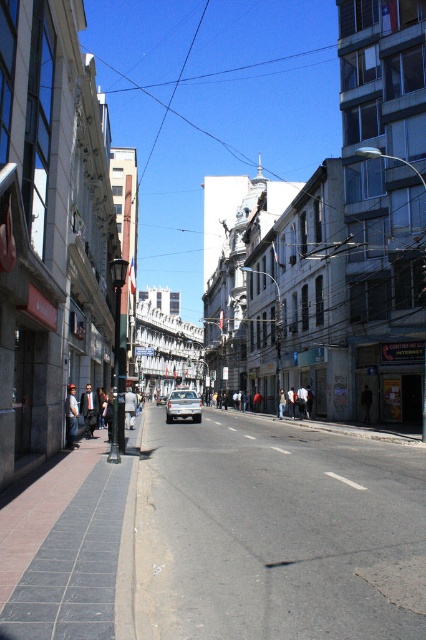
Question: Can you confirm if gray asphalt road at center is positioned above silver metallic car at center?

Choices:
 (A) yes
 (B) no

Answer: (A)

Question: Observing the image, what is the correct spatial positioning of gray asphalt road at center in reference to silver metallic car at center?

Choices:
 (A) above
 (B) below

Answer: (A)

Question: Can you confirm if gray asphalt road at center is smaller than silver metallic car at center?

Choices:
 (A) no
 (B) yes

Answer: (A)